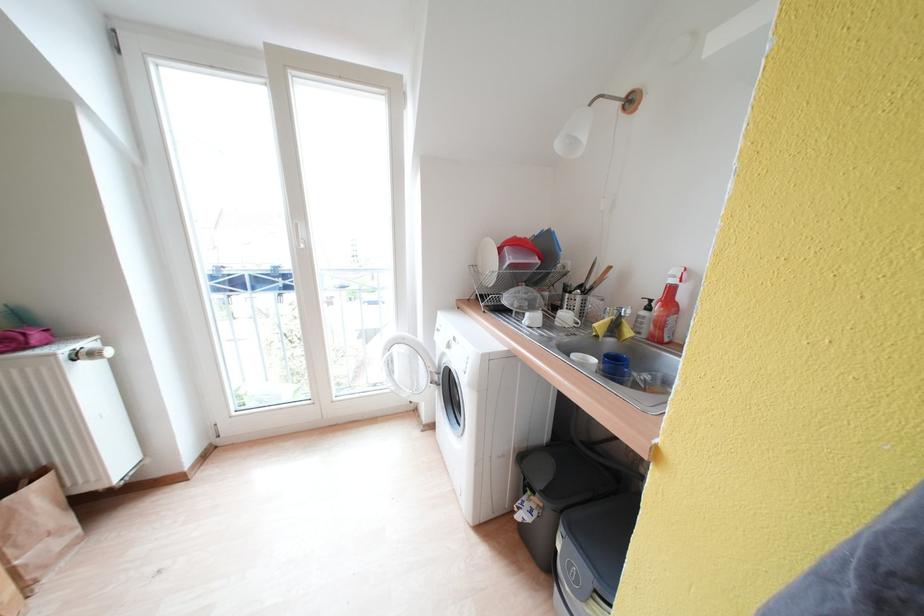
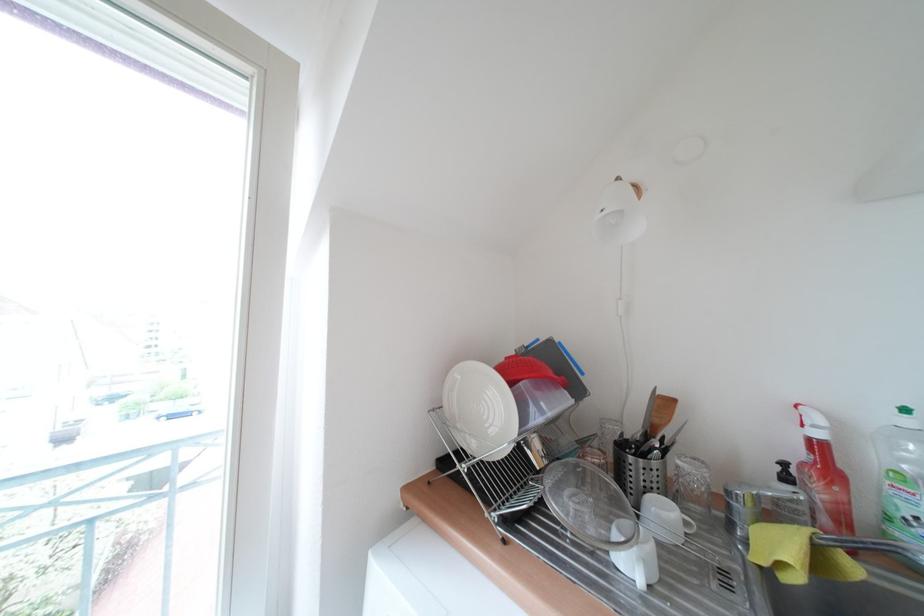
Where in the second image is the point corresponding to (x=654, y=312) from the first image?

(793, 482)